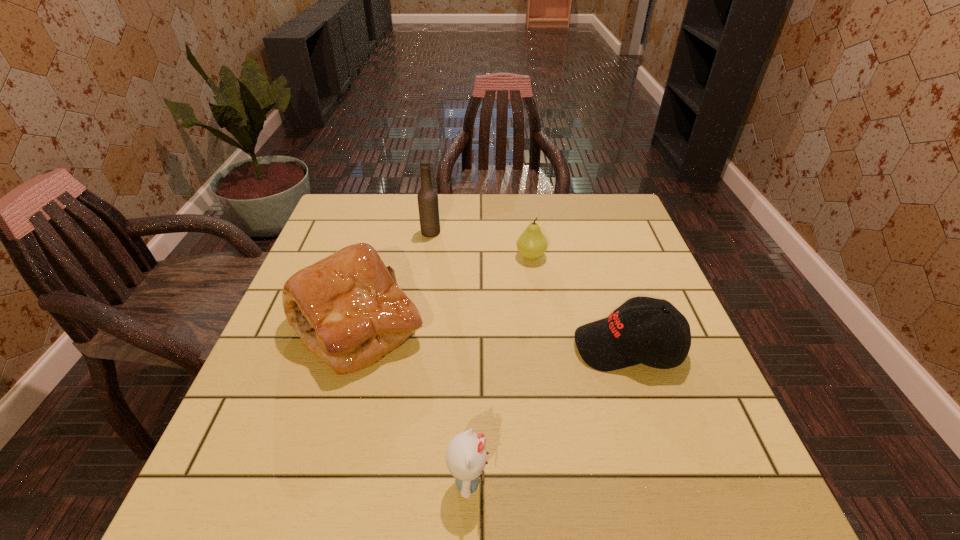
The image size is (960, 540). I want to click on free spot located on the left of the pear, so click(463, 256).

Identify the location of free region located on the front-facing side of the baseball cap. (481, 347).

Find the location of a particular element. The width and height of the screenshot is (960, 540). vacant space located on the front-facing side of the baseball cap is located at coordinates (405, 347).

Where is `free space located 0.110m on the front-facing side of the baseball cap`? free space located 0.110m on the front-facing side of the baseball cap is located at coordinates (525, 347).

The image size is (960, 540). In order to click on free space located on the front-facing side of the kitten in this screenshot , I will do `click(637, 481)`.

The width and height of the screenshot is (960, 540). In order to click on object located at the far edge in this screenshot , I will do `click(428, 205)`.

You are a GUI agent. You are given a task and a screenshot of the screen. Output one action in this format:
    pyautogui.click(x=<x>, y=<y>)
    Task: Click on the object that is positioned at the near edge
    The width and height of the screenshot is (960, 540).
    Given the screenshot: What is the action you would take?
    pyautogui.click(x=466, y=456)

Image resolution: width=960 pixels, height=540 pixels. What are the coordinates of `object positioned at the left edge` in the screenshot? It's located at (347, 308).

Where is `object that is positioned at the right edge`? Image resolution: width=960 pixels, height=540 pixels. object that is positioned at the right edge is located at coordinates (662, 340).

I want to click on vacant space at the far edge, so click(476, 203).